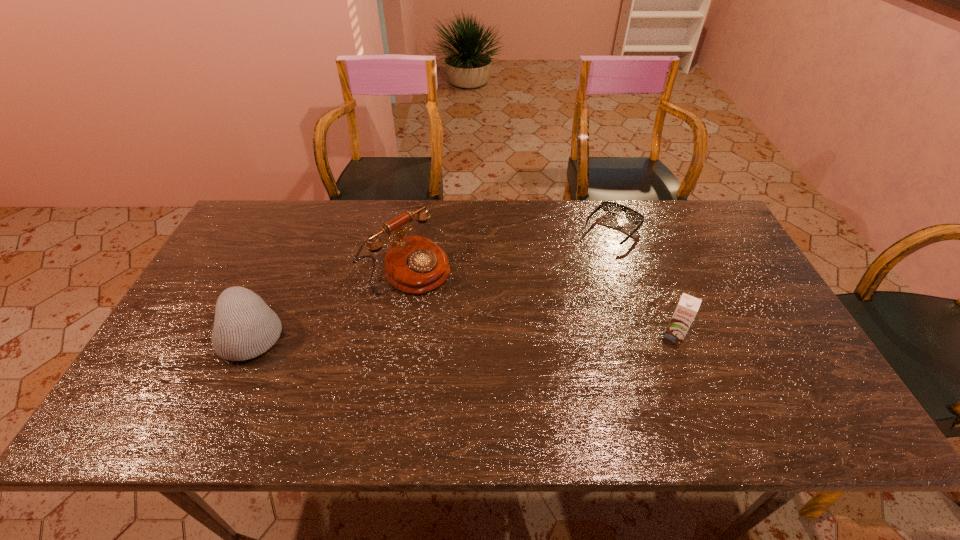
Locate an element on the screen. The height and width of the screenshot is (540, 960). free space located 0.180m on the front-facing side of the sunglasses is located at coordinates (568, 279).

Where is `vacant position located 0.340m on the front-facing side of the sunglasses`? The width and height of the screenshot is (960, 540). vacant position located 0.340m on the front-facing side of the sunglasses is located at coordinates (539, 312).

Locate an element on the screen. The height and width of the screenshot is (540, 960). blank area located on the front-facing side of the sunglasses is located at coordinates (542, 308).

Find the location of `telephone that is at the far edge`. telephone that is at the far edge is located at coordinates (413, 264).

This screenshot has width=960, height=540. In order to click on sunglasses located in the far edge section of the desktop in this screenshot , I will do `click(610, 208)`.

Where is `object present at the near edge`? object present at the near edge is located at coordinates (245, 327).

What are the coordinates of `object that is positioned at the left edge` in the screenshot? It's located at (245, 327).

Image resolution: width=960 pixels, height=540 pixels. Identify the location of object that is positioned at the near left corner. (245, 327).

Image resolution: width=960 pixels, height=540 pixels. In order to click on free spot at the far edge of the desktop in this screenshot , I will do `click(510, 207)`.

The width and height of the screenshot is (960, 540). Find the location of `free location at the near edge`. free location at the near edge is located at coordinates (261, 379).